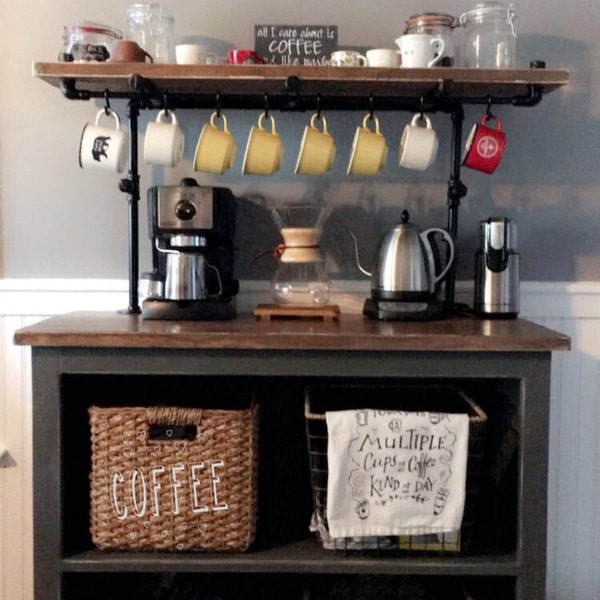
You are a GUI agent. You are given a task and a screenshot of the screen. Output one action in this format:
    pyautogui.click(x=<x>, y=<y>)
    Task: Click on the knob for coffee maker setting
    The width and height of the screenshot is (600, 600).
    Given the screenshot: What is the action you would take?
    pyautogui.click(x=180, y=210)